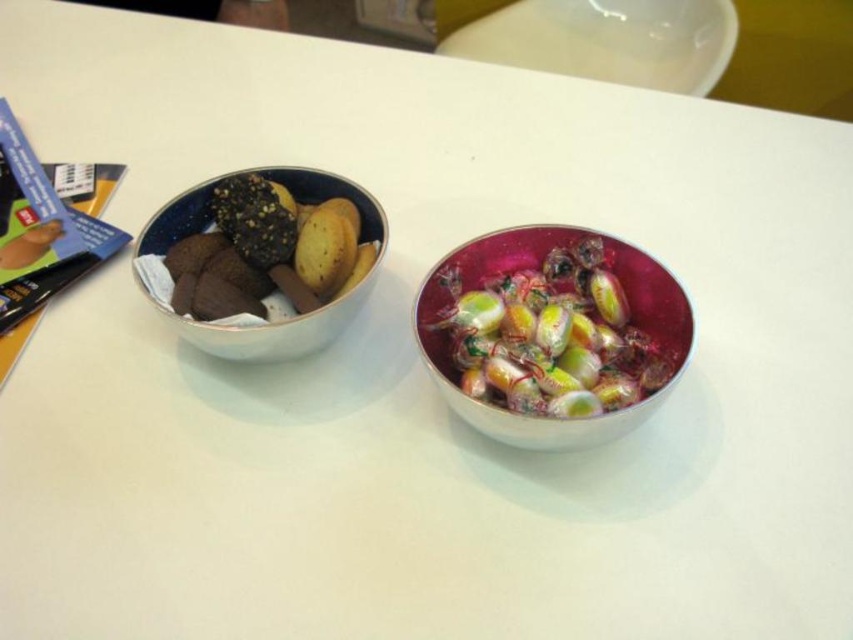
Based on the photo, you are at a party and want to grab a snack from the table. You see the shiny metallic bowl at center and the matte ceramic bowl at left. Which bowl is taller?

The shiny metallic bowl at center is taller than the matte ceramic bowl at left.

You are a delivery robot that needs to place a package between the shiny metallic bowl at center and the matte ceramic bowl at left. The package is 30 centimeters long. Can you fit it between them without moving the bowls?

The shiny metallic bowl at center is 32.41 centimeters away from the matte ceramic bowl at left. Since the package is 30 centimeters long, it can fit between them as the distance is sufficient.

You are standing at the edge of the table looking at the two points marked on the table surface. Which point, point (439, 376) or point (357, 305), is closer to you?

Point (439, 376) is closer to you because it is in front of point (357, 305).